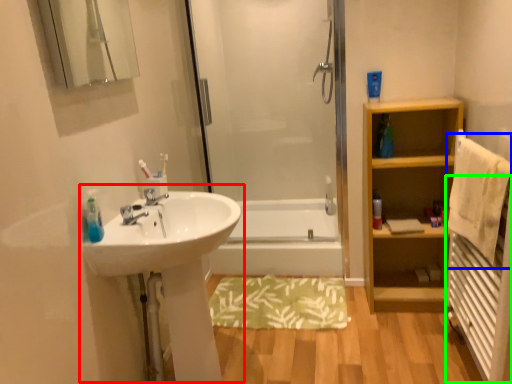
Question: Considering the real-world distances, which object is closest to sink (highlighted by a red box)? bath towel (highlighted by a blue box) or radiator (highlighted by a green box).

Choices:
 (A) bath towel
 (B) radiator

Answer: (A)